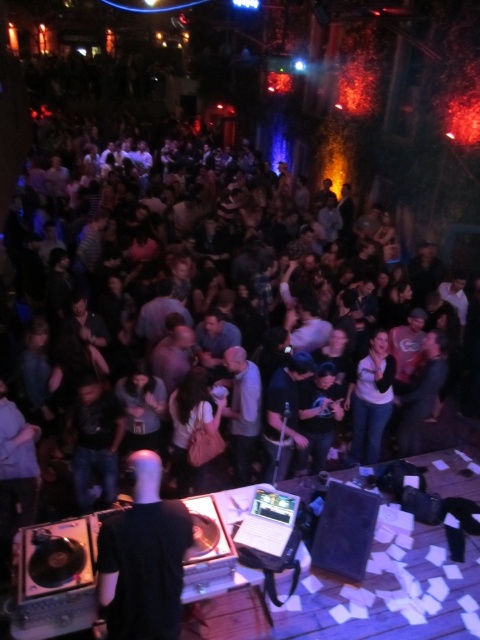
You are a photographer at the nightclub trying to capture a clear photo of the DJ booth. You notice two people in the crowd wearing shirts of different colors. The white matte shirt at center and the light gray shirt at center are blocking your view. Which shirt should you move to get a better angle?

The white matte shirt at center is taller than the light gray shirt at center, so moving the white matte shirt at center would likely provide a better angle since it is the taller obstruction.

You are a photographer standing at the back of the nightclub. You want to take a photo of both the white matte shirt at center and the light gray shirt at center in the same frame. Given that your camera has a maximum focus range of 4 feet, can you capture both subjects clearly in one shot?

The white matte shirt at center is 3.96 feet from the light gray shirt at center. Since the distance between them is within the camera maximum focus range of 4 feet, you can capture both subjects clearly in one shot.